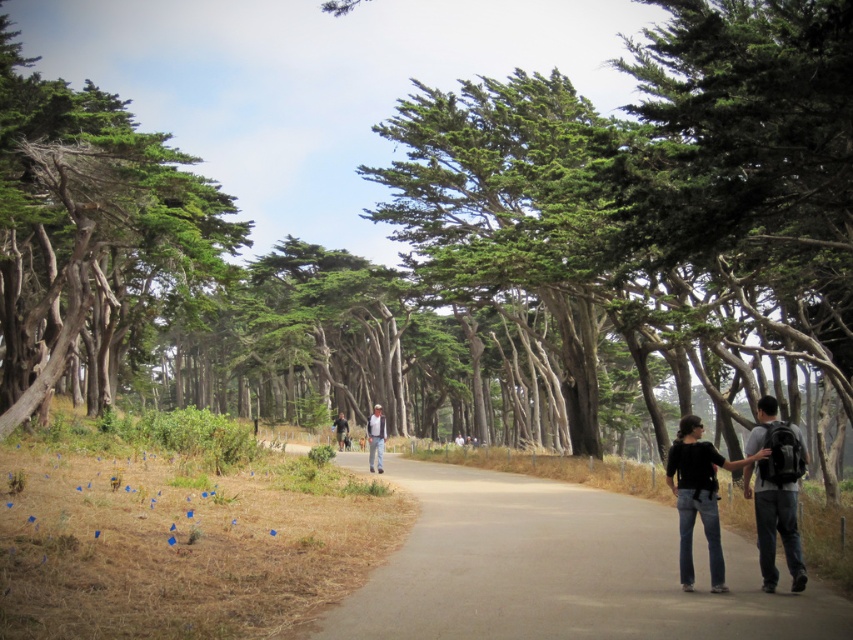
Question: Which object is positioned closest to the light blue jeans at center?

Choices:
 (A) dark gray backpack at right
 (B) smooth asphalt path at center
 (C) black denim jeans at right

Answer: (B)

Question: Is black denim jeans at right to the left of dark gray backpack at right from the viewer's perspective?

Choices:
 (A) yes
 (B) no

Answer: (A)

Question: Based on their relative distances, which object is farther from the light blue jeans at center?

Choices:
 (A) black denim jeans at right
 (B) green textured trees at left
 (C) dark gray backpack at right
 (D) smooth asphalt path at center

Answer: (A)

Question: Which point is farther from the camera taking this photo?

Choices:
 (A) (209, 218)
 (B) (485, 611)
 (C) (668, 452)

Answer: (A)

Question: Does smooth asphalt path at center have a smaller size compared to dark gray backpack at right?

Choices:
 (A) no
 (B) yes

Answer: (A)

Question: Is smooth asphalt path at center thinner than green textured trees at left?

Choices:
 (A) no
 (B) yes

Answer: (B)